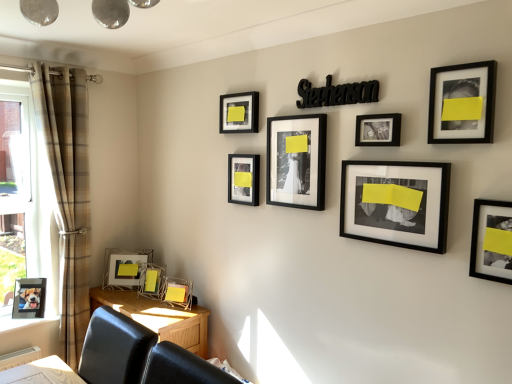
Question: From the image's perspective, would you say metallic silver picture frame at lower left, which appears as the ninth picture frame when viewed from the right, is shown under matte black picture frame at upper center, acting as the seventh picture frame starting from the right?

Choices:
 (A) yes
 (B) no

Answer: (A)

Question: Is metallic silver picture frame at lower left, which appears as the ninth picture frame when viewed from the right, next to matte black picture frame at upper center, which is the 4th picture frame from left to right?

Choices:
 (A) yes
 (B) no

Answer: (B)

Question: Is metallic silver picture frame at lower left, which appears as the ninth picture frame when viewed from the right, wider than matte black picture frame at upper center, acting as the seventh picture frame starting from the right?

Choices:
 (A) yes
 (B) no

Answer: (A)

Question: Does metallic silver picture frame at lower left, which appears as the ninth picture frame when viewed from the right, have a smaller size compared to matte black picture frame at upper center, acting as the seventh picture frame starting from the right?

Choices:
 (A) no
 (B) yes

Answer: (A)

Question: Is metallic silver picture frame at lower left, the 2th picture frame in the left-to-right sequence, further to camera compared to matte black picture frame at upper center, which is the 4th picture frame from left to right?

Choices:
 (A) no
 (B) yes

Answer: (B)

Question: Is point (154, 291) positioned closer to the camera than point (102, 283)?

Choices:
 (A) closer
 (B) farther

Answer: (A)

Question: From a real-world perspective, is matte glass picture frame at lower left, which is counted as the 3th picture frame, starting from the left, above or below metallic silver picture frame at lower left, the 2th picture frame in the left-to-right sequence?

Choices:
 (A) above
 (B) below

Answer: (B)

Question: From the image's perspective, is matte glass picture frame at lower left, the 8th picture frame viewed from the right, located above or below metallic silver picture frame at lower left, which appears as the ninth picture frame when viewed from the right?

Choices:
 (A) above
 (B) below

Answer: (B)

Question: Considering the positions of matte glass picture frame at lower left, the 8th picture frame viewed from the right, and metallic silver picture frame at lower left, which appears as the ninth picture frame when viewed from the right, in the image, is matte glass picture frame at lower left, the 8th picture frame viewed from the right, taller or shorter than metallic silver picture frame at lower left, which appears as the ninth picture frame when viewed from the right,?

Choices:
 (A) tall
 (B) short

Answer: (B)

Question: From the image's perspective, is black matte photo frame at center right, arranged as the eighth picture frame when viewed from the left, above or below metallic silver picture frame at lower left, which appears as the ninth picture frame when viewed from the right?

Choices:
 (A) above
 (B) below

Answer: (A)

Question: From a real-world perspective, relative to metallic silver picture frame at lower left, the 2th picture frame in the left-to-right sequence, is black matte photo frame at center right, which is the 3th picture frame in right-to-left order, vertically above or below?

Choices:
 (A) below
 (B) above

Answer: (B)

Question: Based on their positions, is black matte photo frame at center right, which is the 3th picture frame in right-to-left order, located to the left or right of metallic silver picture frame at lower left, which appears as the ninth picture frame when viewed from the right?

Choices:
 (A) left
 (B) right

Answer: (B)

Question: Is black matte photo frame at center right, arranged as the eighth picture frame when viewed from the left, inside or outside of metallic silver picture frame at lower left, which appears as the ninth picture frame when viewed from the right?

Choices:
 (A) outside
 (B) inside

Answer: (A)

Question: Is black matte photo frame at center right, arranged as the eighth picture frame when viewed from the left, spatially inside matte black photo frame at center, arranged as the fifth picture frame when viewed from the left, or outside of it?

Choices:
 (A) outside
 (B) inside

Answer: (A)

Question: Is black matte photo frame at center right, arranged as the eighth picture frame when viewed from the left, wider or thinner than matte black photo frame at center, arranged as the fifth picture frame when viewed from the left?

Choices:
 (A) thin
 (B) wide

Answer: (B)